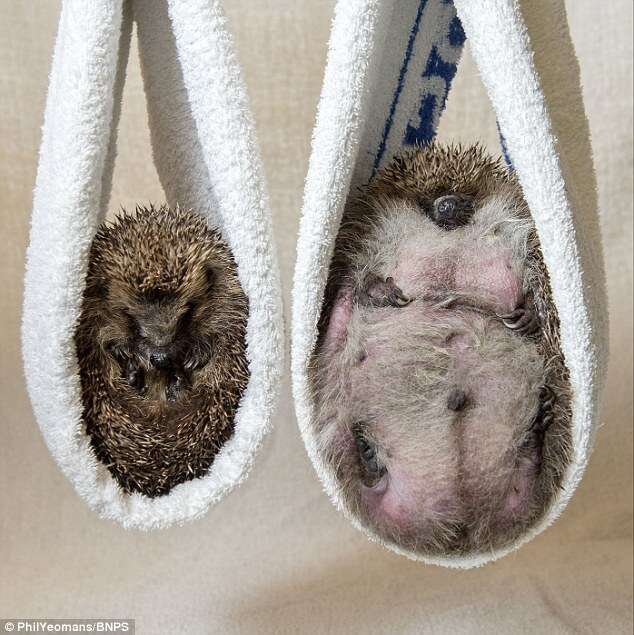
Identify the location of towels. The width and height of the screenshot is (634, 635). (216, 133), (331, 135).